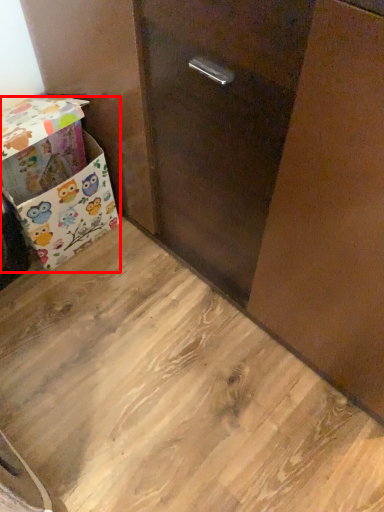
Question: Where is box (annotated by the red box) located in relation to plywood in the image?

Choices:
 (A) right
 (B) left

Answer: (B)